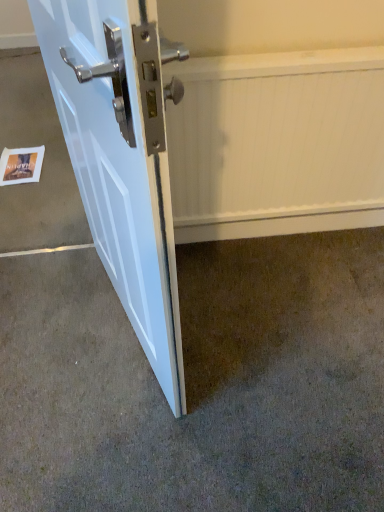
Question: From the image's perspective, is white textured radiator at center located above or below white paper postcard at lower left?

Choices:
 (A) below
 (B) above

Answer: (A)

Question: Considering the positions of point [357, 187] and point [34, 146], is point [357, 187] closer or farther from the camera than point [34, 146]?

Choices:
 (A) closer
 (B) farther

Answer: (A)

Question: Considering the real-world distances, which object is closest to the white textured radiator at center?

Choices:
 (A) brown carpet at lower left
 (B) white glossy door at lower left
 (C) white paper postcard at lower left

Answer: (A)

Question: Which of these objects is positioned closest to the white glossy door at lower left?

Choices:
 (A) brown carpet at lower left
 (B) white paper postcard at lower left
 (C) white textured radiator at center

Answer: (A)